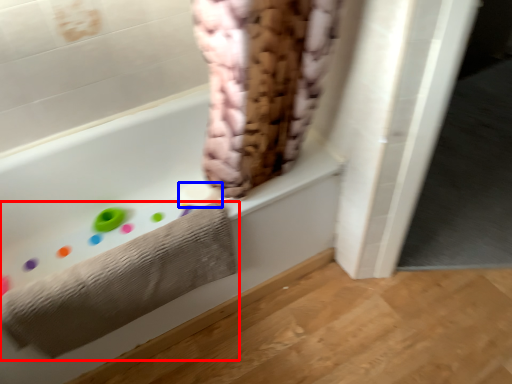
Question: Which object is further to the camera taking this photo, towel (highlighted by a red box) or toilet paper (highlighted by a blue box)?

Choices:
 (A) towel
 (B) toilet paper

Answer: (B)